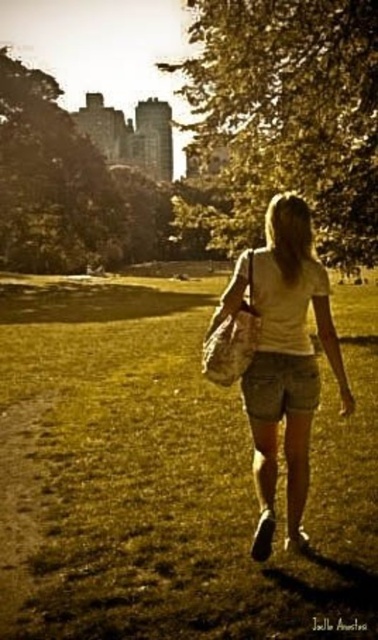
Based on the photo, does green leafy tree at upper center appear on the right side of brown dirt path at lower left?

Incorrect, green leafy tree at upper center is not on the right side of brown dirt path at lower left.

Does point (235, 35) come in front of point (6, 547)?

That is False.

Is point (271, 100) positioned before point (3, 572)?

No.

The height and width of the screenshot is (640, 378). Identify the location of green leafy tree at upper center. (286, 116).

Can you confirm if matte beige shorts at center is wider than brown dirt path at lower left?

No, matte beige shorts at center is not wider than brown dirt path at lower left.

Is matte beige shorts at center to the left of brown dirt path at lower left from the viewer's perspective?

No, matte beige shorts at center is not to the left of brown dirt path at lower left.

Locate an element on the screen. Image resolution: width=378 pixels, height=640 pixels. matte beige shorts at center is located at coordinates (286, 362).

Identify the location of matte beige shorts at center. The image size is (378, 640). (286, 362).

Consider the image. Between matte beige shorts at center and denim shorts at center, which one has more height?

With more height is matte beige shorts at center.

Is matte beige shorts at center above denim shorts at center?

Correct, matte beige shorts at center is located above denim shorts at center.

Image resolution: width=378 pixels, height=640 pixels. Find the location of `matte beige shorts at center`. matte beige shorts at center is located at coordinates (286, 362).

Where is `matte beige shorts at center`? The width and height of the screenshot is (378, 640). matte beige shorts at center is located at coordinates (286, 362).